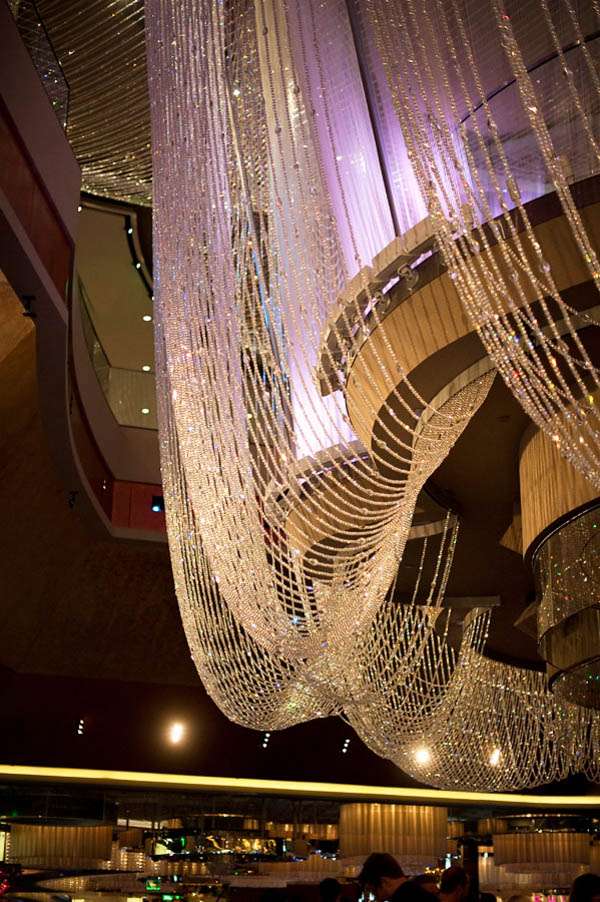
I want to click on wood panels, so click(x=27, y=216), click(x=131, y=521).